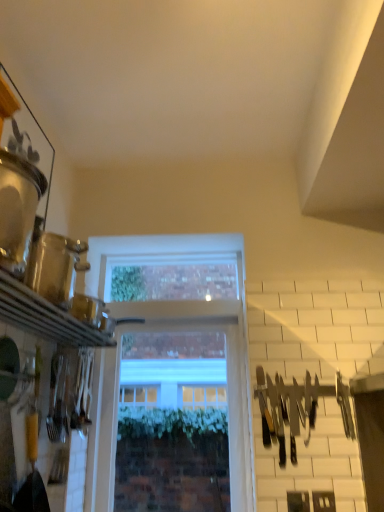
Question: Does point 144,412 appear closer or farther from the camera than point 352,434?

Choices:
 (A) farther
 (B) closer

Answer: (A)

Question: In terms of width, does clear glass window at center look wider or thinner when compared to black plastic knives at right?

Choices:
 (A) thin
 (B) wide

Answer: (B)

Question: Considering the positions of clear glass window at center and black plastic knives at right in the image, is clear glass window at center bigger or smaller than black plastic knives at right?

Choices:
 (A) big
 (B) small

Answer: (A)

Question: Considering the positions of point (263, 430) and point (193, 340), is point (263, 430) closer or farther from the camera than point (193, 340)?

Choices:
 (A) farther
 (B) closer

Answer: (B)

Question: Is black plastic knives at right to the left or to the right of clear glass window at center in the image?

Choices:
 (A) left
 (B) right

Answer: (B)

Question: From the image's perspective, is black plastic knives at right positioned above or below clear glass window at center?

Choices:
 (A) below
 (B) above

Answer: (B)

Question: From a real-world perspective, is black plastic knives at right positioned above or below clear glass window at center?

Choices:
 (A) above
 (B) below

Answer: (B)